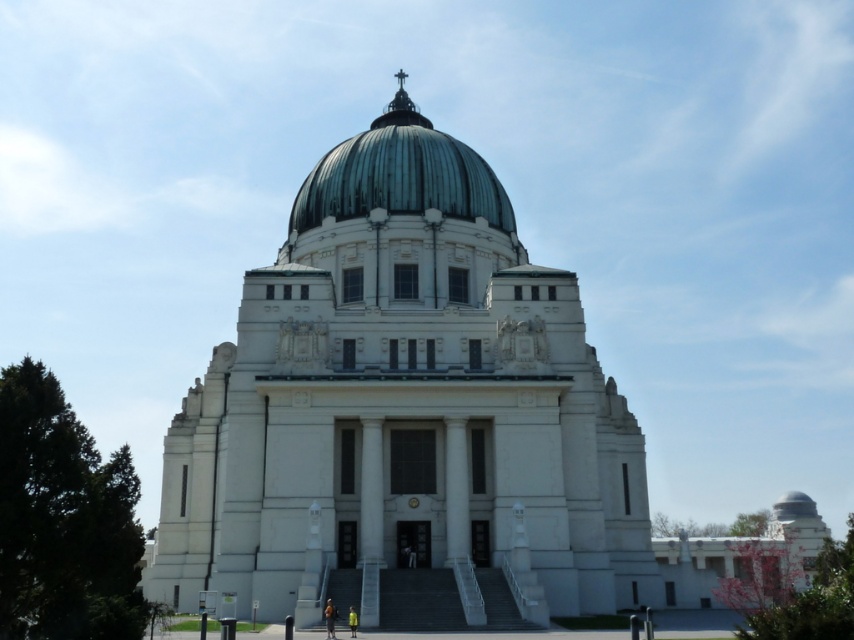
From the picture: Does white stone church at center have a greater width compared to green copper dome at center?

Yes, white stone church at center is wider than green copper dome at center.

Is white stone church at center to the left of green copper dome at center from the viewer's perspective?

No, white stone church at center is not to the left of green copper dome at center.

Does point (489, 262) come closer to viewer compared to point (417, 141)?

Yes, it is in front of point (417, 141).

At what (x,y) coordinates should I click in order to perform the action: click on white stone church at center. Please return your answer as a coordinate pair (x, y). The width and height of the screenshot is (854, 640). Looking at the image, I should click on (408, 412).